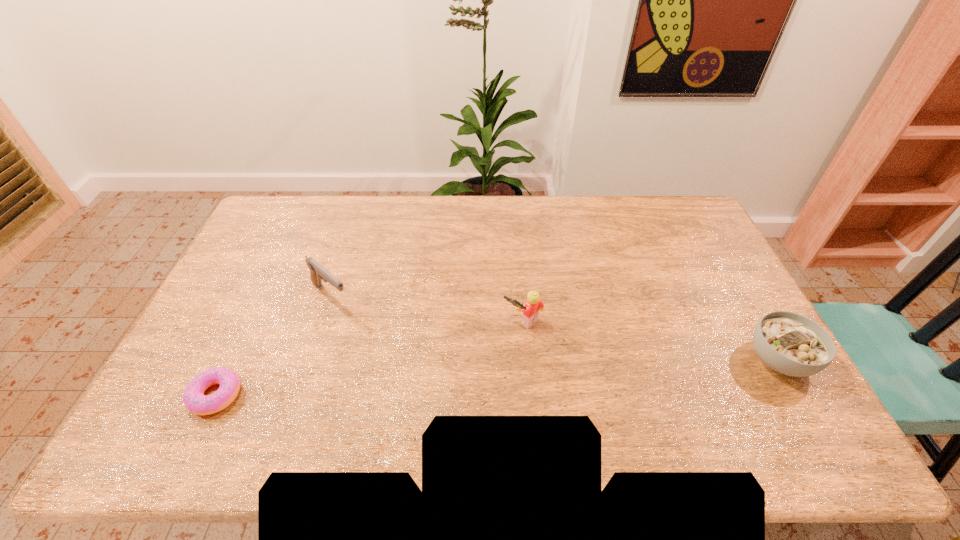
Image resolution: width=960 pixels, height=540 pixels. Identify the location of vacant space on the desktop that is between the shortest object and the rightmost object and is positioned at the barrel of the pistol. (430, 381).

Locate an element on the screen. The height and width of the screenshot is (540, 960). vacant spot on the desktop that is between the shortest object and the rightmost object and is positioned in front of the Lego with the accessory visible is located at coordinates 459,380.